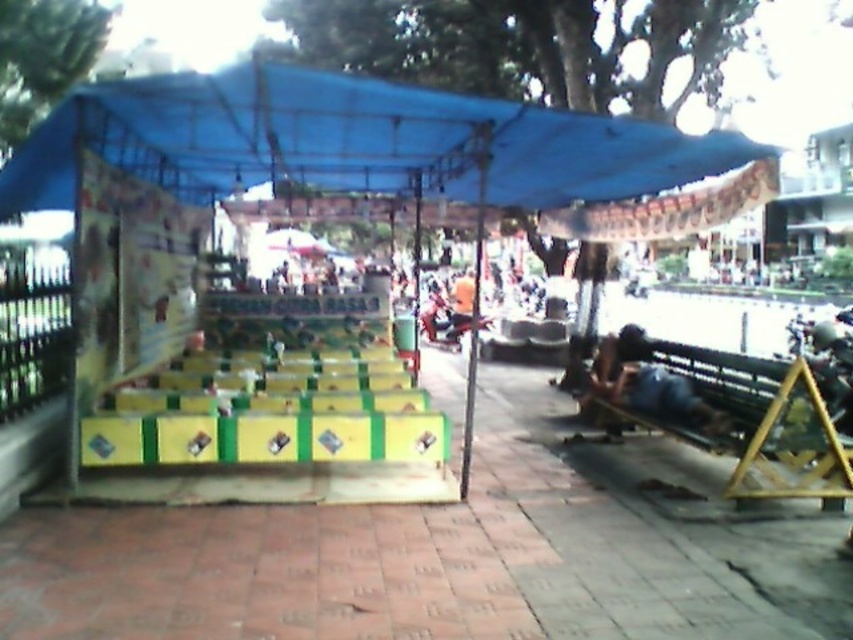
Is blue tarpaulin canopy at upper center wider than dark blue fabric at lower right?

Yes.

Who is shorter, blue tarpaulin canopy at upper center or dark blue fabric at lower right?

Standing shorter between the two is dark blue fabric at lower right.

Which is in front, point (494, 138) or point (688, 385)?

Point (494, 138)

The width and height of the screenshot is (853, 640). Find the location of `blue tarpaulin canopy at upper center`. blue tarpaulin canopy at upper center is located at coordinates (355, 141).

Describe the element at coordinates (450, 552) in the screenshot. I see `green painted concrete pavement at center` at that location.

Is green painted concrete pavement at center taller than blue fabric tent at center?

Incorrect, green painted concrete pavement at center's height is not larger of blue fabric tent at center's.

Which is behind, point (44, 586) or point (494, 129)?

The point (494, 129) is more distant.

The image size is (853, 640). Identify the location of green painted concrete pavement at center. (450, 552).

Which is more to the left, green painted concrete pavement at center or blue tarpaulin canopy at upper center?

blue tarpaulin canopy at upper center

Is green painted concrete pavement at center thinner than blue tarpaulin canopy at upper center?

Correct, green painted concrete pavement at center's width is less than blue tarpaulin canopy at upper center's.

The width and height of the screenshot is (853, 640). Describe the element at coordinates (450, 552) in the screenshot. I see `green painted concrete pavement at center` at that location.

Locate an element on the screen. This screenshot has height=640, width=853. green painted concrete pavement at center is located at coordinates (450, 552).